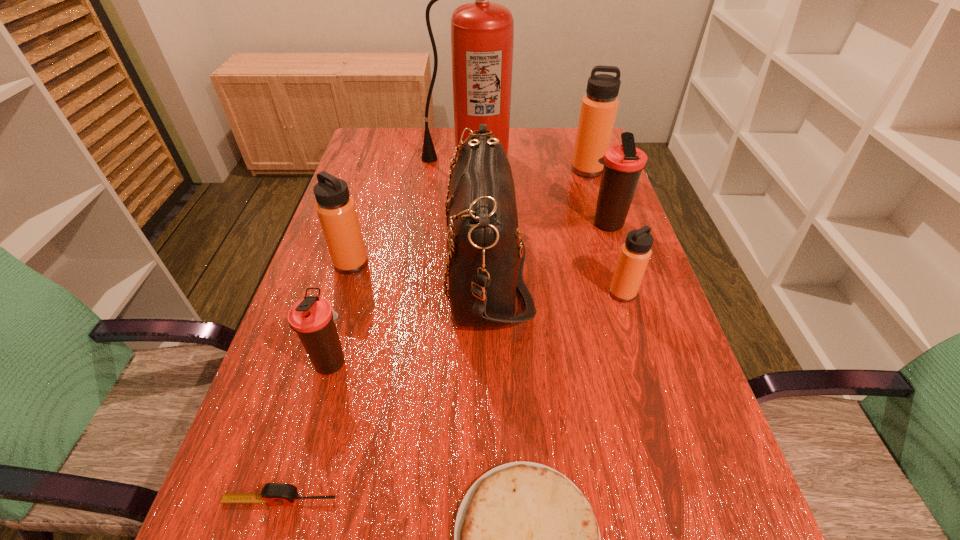
What are the coordinates of `the fifth closest thermos bottle to the handbag` in the screenshot? It's located at (599, 107).

Identify which orange thermos bottle is the second nearest to the shortest object. Please provide its 2D coordinates. Your answer should be formatted as a tuple, i.e. [(x, y)], where the tuple contains the x and y coordinates of a point satisfying the conditions above.

[(336, 210)]

Locate which orange thermos bottle ranks in proximity to the biggest orange thermos bottle. Please provide its 2D coordinates. Your answer should be formatted as a tuple, i.e. [(x, y)], where the tuple contains the x and y coordinates of a point satisfying the conditions above.

[(635, 253)]

The image size is (960, 540). I want to click on vacant area in the image that satisfies the following two spatial constraints: 1. on the back side of the fourth nearest thermos bottle; 2. on the left side of the smaller brown thermos bottle, so click(372, 225).

What are the coordinates of `blank area in the image that satisfies the following two spatial constraints: 1. on the front side of the second smallest orange thermos bottle; 2. on the right side of the smallest orange thermos bottle` in the screenshot? It's located at (343, 293).

Where is `free space that satisfies the following two spatial constraints: 1. on the back side of the third farthest thermos bottle; 2. on the left side of the black tape measure`? free space that satisfies the following two spatial constraints: 1. on the back side of the third farthest thermos bottle; 2. on the left side of the black tape measure is located at coordinates (351, 264).

This screenshot has height=540, width=960. What are the coordinates of `free space that satisfies the following two spatial constraints: 1. at the front of the nearest orange thermos bottle with chain and zipper; 2. on the left side of the handbag` in the screenshot? It's located at (487, 293).